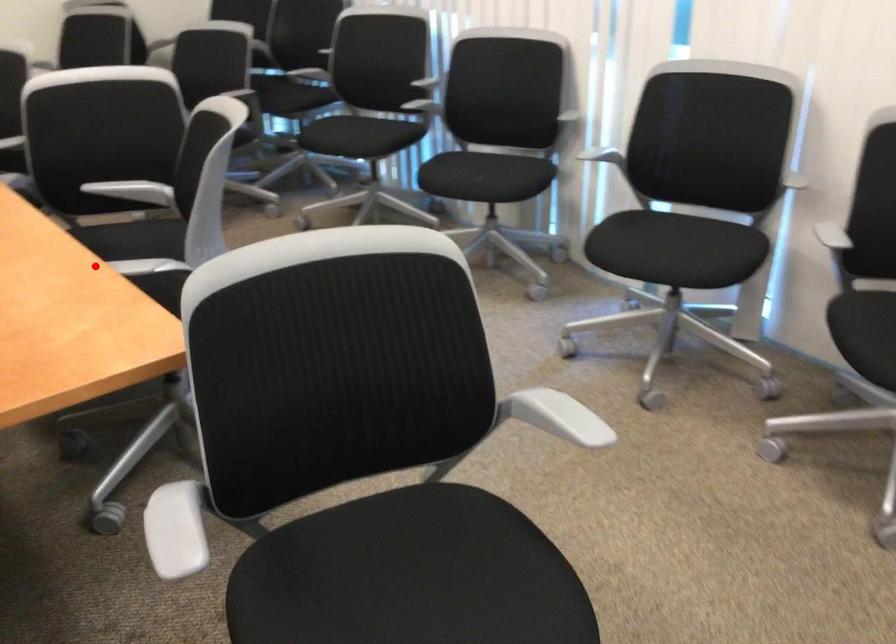
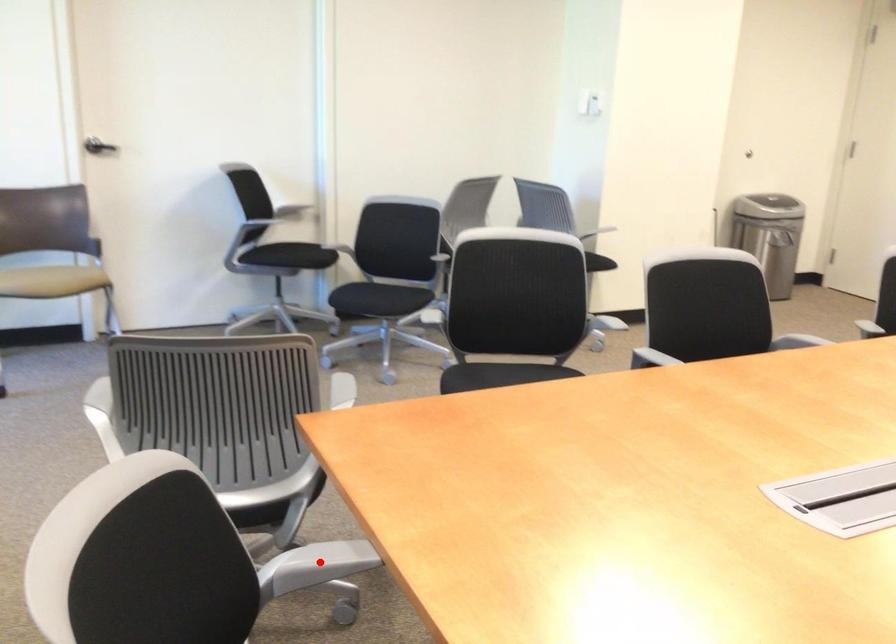
I am providing you with two images of the same scene from different viewpoints. A red point is marked on the first image and another point is marked on the second image. Does the point marked in image1 correspond to the same location as the one in image2?

Yes